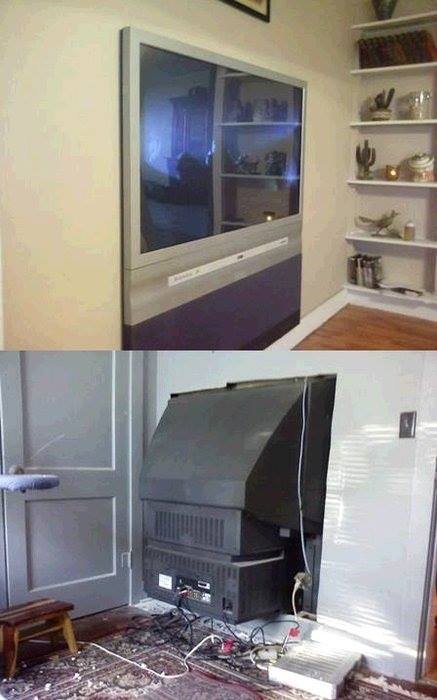
In order to click on shelves in this screenshot , I will do coord(404,242), coord(387,295), coord(376,183), coord(382,124), coord(373,71), coord(403,21).